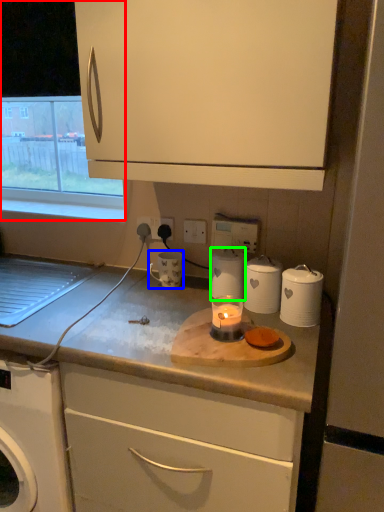
Question: Which is nearer to the window (highlighted by a red box)? mug (highlighted by a blue box) or kitchen appliance (highlighted by a green box).

Choices:
 (A) mug
 (B) kitchen appliance

Answer: (A)